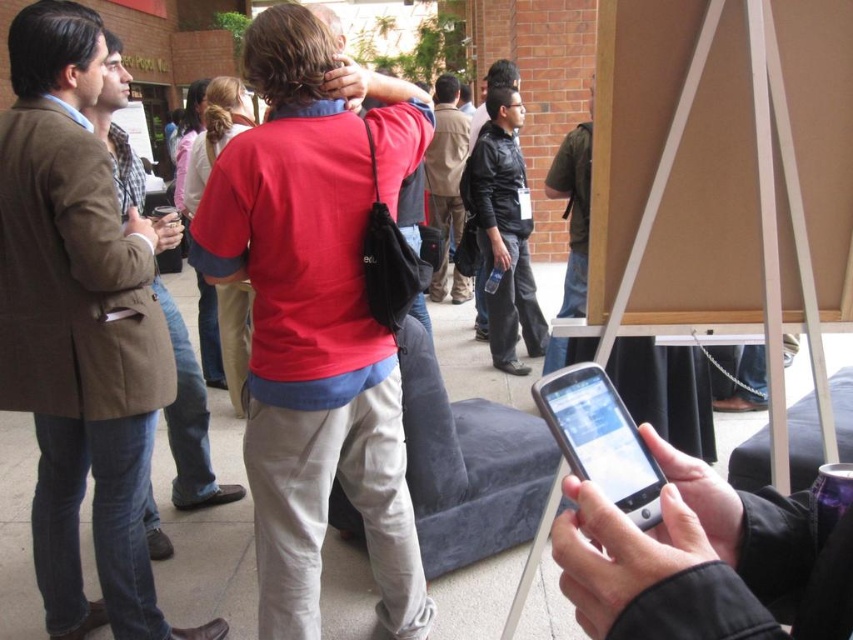
Question: Does matte red shirt at center appear under brown wool coat at left?

Choices:
 (A) no
 (B) yes

Answer: (B)

Question: Which object appears closest to the camera in this image?

Choices:
 (A) matte red shirt at center
 (B) black leather jacket at center

Answer: (A)

Question: Which object is closer to the camera taking this photo?

Choices:
 (A) dark gray pants at center
 (B) dark green shirt at center
 (C) black leather jacket at center

Answer: (B)

Question: Which is nearer to the brown wool coat at left?

Choices:
 (A) dark green shirt at center
 (B) black leather jacket at center
 (C) matte red shirt at center

Answer: (C)

Question: Can you confirm if brown wool coat at left is positioned below dark green shirt at center?

Choices:
 (A) no
 (B) yes

Answer: (B)

Question: Does matte red shirt at center have a lesser width compared to brown wool coat at left?

Choices:
 (A) yes
 (B) no

Answer: (B)